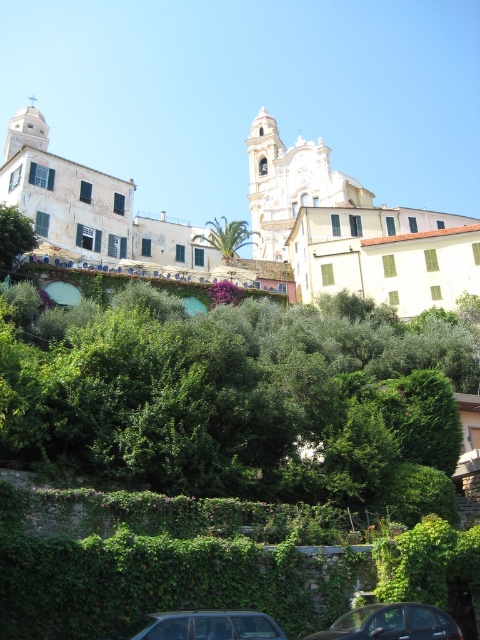
You are standing at the center of the image and want to walk towards the green leafy hedge at center. Which direction should you go?

The green leafy hedge at center is already at the center of the image, so you are already facing it directly.

You are standing at the bottom of the hill and looking up towards the white stone church at upper center and the metallic silver car at lower center. Which object appears taller from your vantage point?

The white stone church at upper center appears taller than the metallic silver car at lower center because it has a greater height compared to the car.

You are a visitor arriving by car and want to park your metallic silver car at lower center near the white stone church at upper center. Based on the scene, can you drive directly from your current position to the church?

The white stone church at upper center is located above the metallic silver car at lower center, which means it is higher in elevation. Since the metallic silver car at lower center is at a lower position, you would need to drive uphill to reach the church. However, the scene does not mention any roads or pathways connecting the two locations, so it is unclear if there is a direct route available.